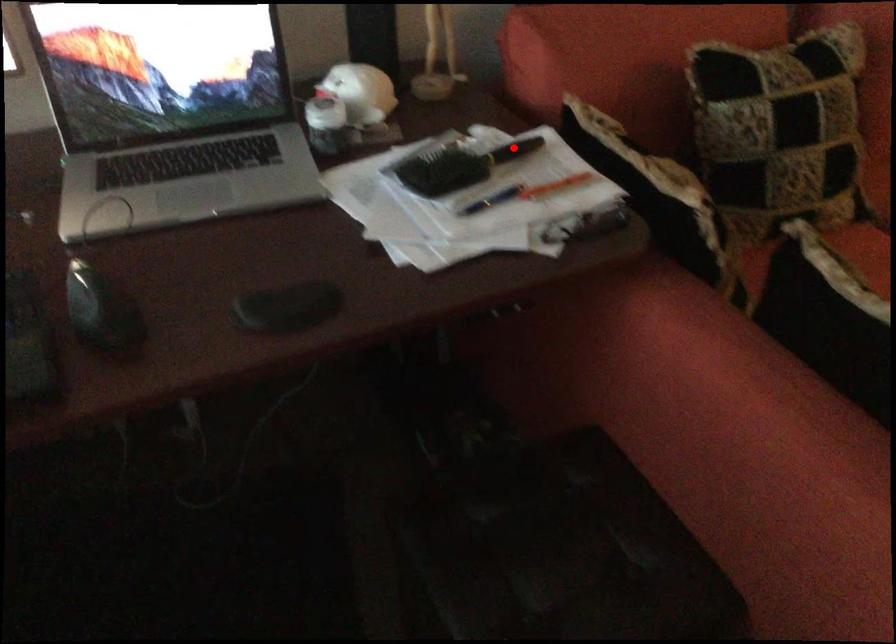
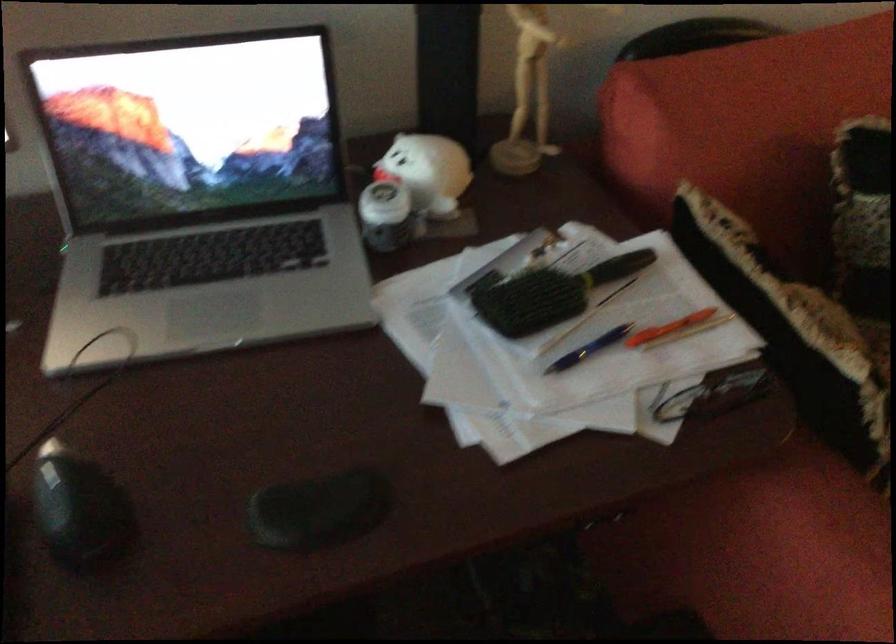
In the second image, find the point that corresponds to the highlighted location in the first image.

(616, 267)